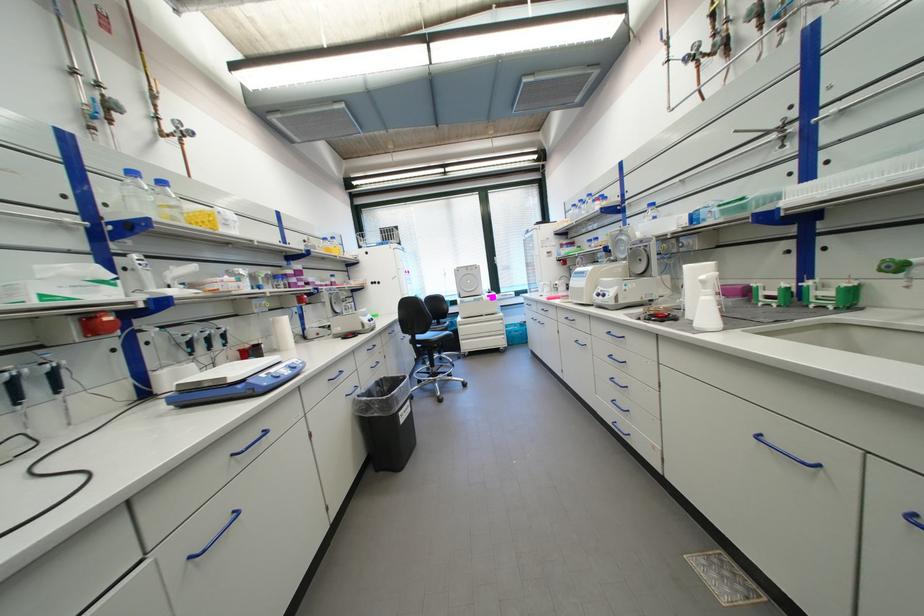
The location [708,305] corresponds to which object?

It refers to a white spray bottle.